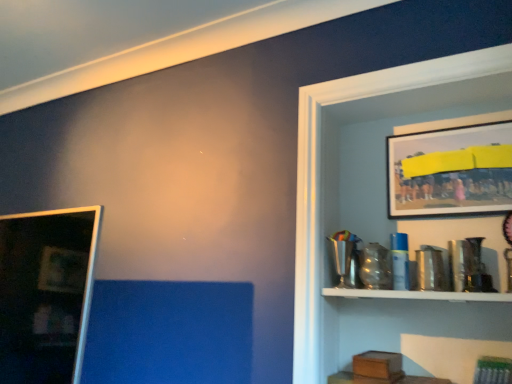
Question: Can you confirm if metallic silver shelf at upper right is shorter than metallic framed picture at upper right, the second picture frame viewed from the left?

Choices:
 (A) no
 (B) yes

Answer: (A)

Question: Can you confirm if metallic silver shelf at upper right is smaller than metallic framed picture at upper right, placed as the first picture frame when sorted from top to bottom?

Choices:
 (A) no
 (B) yes

Answer: (A)

Question: Can you confirm if metallic silver shelf at upper right is positioned to the right of metallic framed picture at upper right, the 2th picture frame in the bottom-to-top sequence?

Choices:
 (A) yes
 (B) no

Answer: (B)

Question: Considering the relative positions of metallic silver shelf at upper right and metallic framed picture at upper right, placed as the first picture frame when sorted from top to bottom, in the image provided, is metallic silver shelf at upper right to the left of metallic framed picture at upper right, placed as the first picture frame when sorted from top to bottom, from the viewer's perspective?

Choices:
 (A) no
 (B) yes

Answer: (B)

Question: Is metallic silver shelf at upper right wider than metallic framed picture at upper right, the first picture frame when ordered from right to left?

Choices:
 (A) yes
 (B) no

Answer: (A)

Question: Visually, is metallic framed picture at upper right, the second picture frame viewed from the left, positioned to the left or to the right of matte black picture frame at left, arranged as the first picture frame when viewed from the left?

Choices:
 (A) left
 (B) right

Answer: (B)

Question: In terms of width, does metallic framed picture at upper right, placed as the first picture frame when sorted from top to bottom, look wider or thinner when compared to matte black picture frame at left, arranged as the first picture frame when viewed from the left?

Choices:
 (A) thin
 (B) wide

Answer: (A)

Question: From a real-world perspective, is metallic framed picture at upper right, the first picture frame when ordered from right to left, positioned above or below matte black picture frame at left, the first picture frame positioned from the bottom?

Choices:
 (A) above
 (B) below

Answer: (A)

Question: From the image's perspective, relative to matte black picture frame at left, the first picture frame positioned from the bottom, is metallic framed picture at upper right, the 2th picture frame in the bottom-to-top sequence, above or below?

Choices:
 (A) below
 (B) above

Answer: (B)

Question: From a real-world perspective, is matte black picture frame at left, which ranks as the second picture frame in top-to-bottom order, physically located above or below metallic silver shelf at upper right?

Choices:
 (A) below
 (B) above

Answer: (A)

Question: Considering the positions of matte black picture frame at left, the first picture frame positioned from the bottom, and metallic silver shelf at upper right in the image, is matte black picture frame at left, the first picture frame positioned from the bottom, taller or shorter than metallic silver shelf at upper right?

Choices:
 (A) tall
 (B) short

Answer: (B)

Question: In the image, is matte black picture frame at left, which ranks as the second picture frame in top-to-bottom order, on the left side or the right side of metallic silver shelf at upper right?

Choices:
 (A) right
 (B) left

Answer: (B)

Question: Relative to metallic silver shelf at upper right, is matte black picture frame at left, which ranks as the second picture frame in right-to-left order, in front or behind?

Choices:
 (A) behind
 (B) front

Answer: (A)

Question: Visually, is metallic silver shelf at upper right positioned to the left or to the right of metallic framed picture at upper right, placed as the first picture frame when sorted from top to bottom?

Choices:
 (A) right
 (B) left

Answer: (B)

Question: Is metallic silver shelf at upper right situated inside metallic framed picture at upper right, the 2th picture frame in the bottom-to-top sequence, or outside?

Choices:
 (A) inside
 (B) outside

Answer: (B)